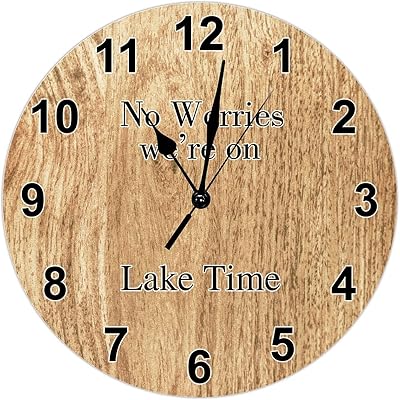
Locate an element on the screen. wooden clock is located at coordinates 311,99.